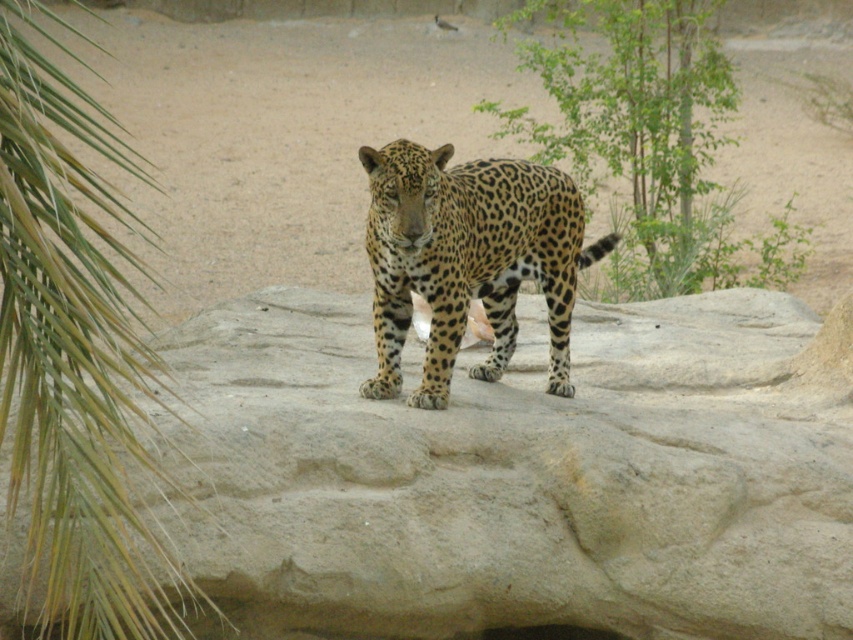
Question: Is smooth rock boulder at center to the left of green leafy palm at left from the viewer's perspective?

Choices:
 (A) no
 (B) yes

Answer: (A)

Question: Does smooth rock boulder at center appear over green leafy palm at left?

Choices:
 (A) yes
 (B) no

Answer: (B)

Question: Can you confirm if green leafy tree at upper right is bigger than spotted fur leopard at center?

Choices:
 (A) yes
 (B) no

Answer: (B)

Question: Which point is farther from the camera taking this photo?

Choices:
 (A) (396, 179)
 (B) (73, 461)
 (C) (490, 109)

Answer: (C)

Question: Based on their relative distances, which object is nearer to the green leafy tree at upper right?

Choices:
 (A) smooth rock boulder at center
 (B) spotted fur leopard at center

Answer: (A)

Question: Which of the following is the farthest from the observer?

Choices:
 (A) smooth rock boulder at center
 (B) spotted fur leopard at center
 (C) green leafy tree at upper right

Answer: (C)